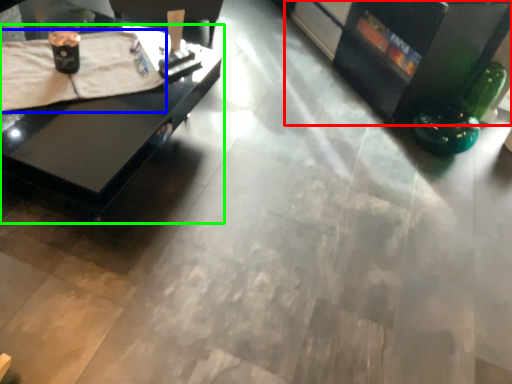
Question: Which object is the farthest from entertainment center (highlighted by a red box)? Choose among these: blanket (highlighted by a blue box) or table (highlighted by a green box).

Choices:
 (A) blanket
 (B) table

Answer: (A)